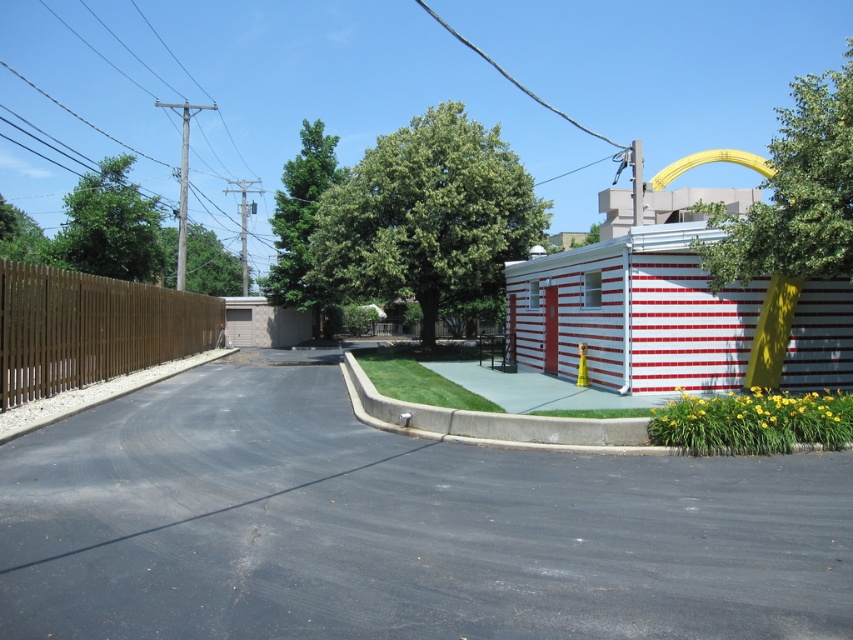
From the picture: Can you confirm if black asphalt driveway at center is taller than brown textured garage door at left?

No, black asphalt driveway at center is not taller than brown textured garage door at left.

This screenshot has height=640, width=853. In order to click on black asphalt driveway at center in this screenshot , I will do `click(397, 525)`.

What are the coordinates of `black asphalt driveway at center` in the screenshot? It's located at (397, 525).

Does brown wooden fence at left appear under brown textured garage door at left?

Indeed, brown wooden fence at left is positioned under brown textured garage door at left.

Is brown wooden fence at left above brown textured garage door at left?

No.

What are the coordinates of `brown wooden fence at left` in the screenshot? It's located at (90, 328).

Locate an element on the screen. brown wooden fence at left is located at coordinates (90, 328).

This screenshot has height=640, width=853. Describe the element at coordinates (397, 525) in the screenshot. I see `black asphalt driveway at center` at that location.

Is point (701, 548) closer to viewer compared to point (48, 340)?

Yes, it is in front of point (48, 340).

Image resolution: width=853 pixels, height=640 pixels. What do you see at coordinates (397, 525) in the screenshot?
I see `black asphalt driveway at center` at bounding box center [397, 525].

The height and width of the screenshot is (640, 853). Identify the location of black asphalt driveway at center. (397, 525).